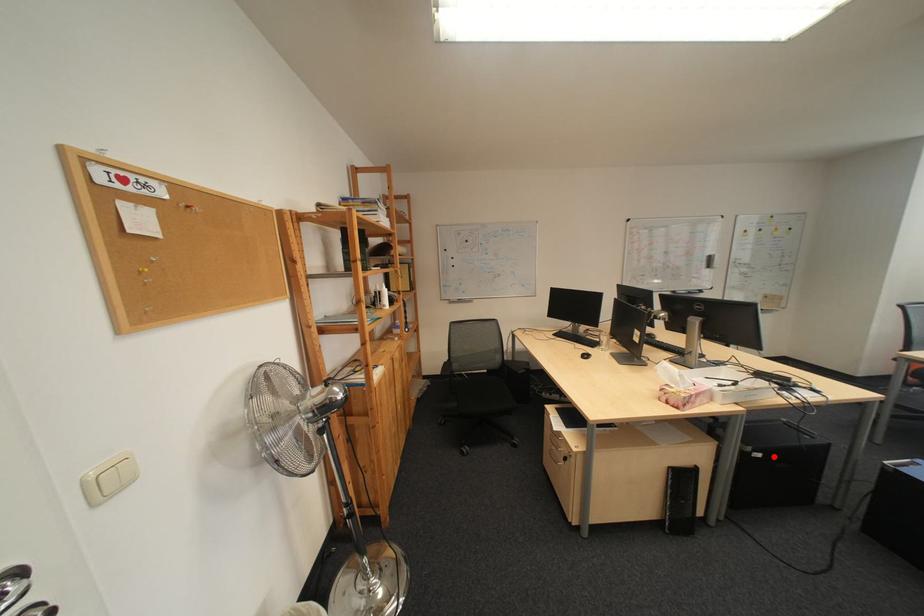
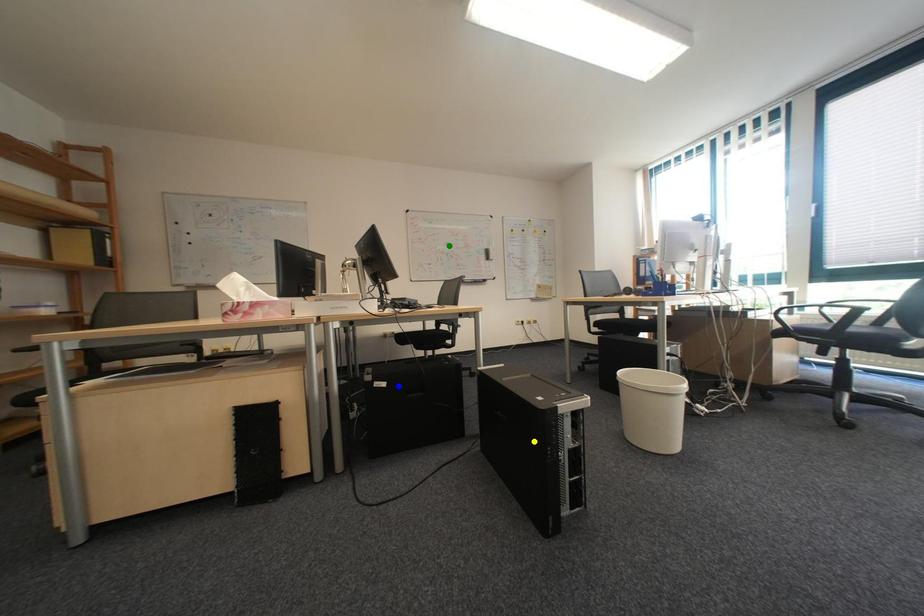
Question: I am providing you with two images of the same scene from different viewpoints. A red point is marked on the first image. You are given multiple points on the second image. Which point in image 2 is actually the same real-world point as the red point in image 1?

Choices:
 (A) green point
 (B) yellow point
 (C) blue point

Answer: (C)